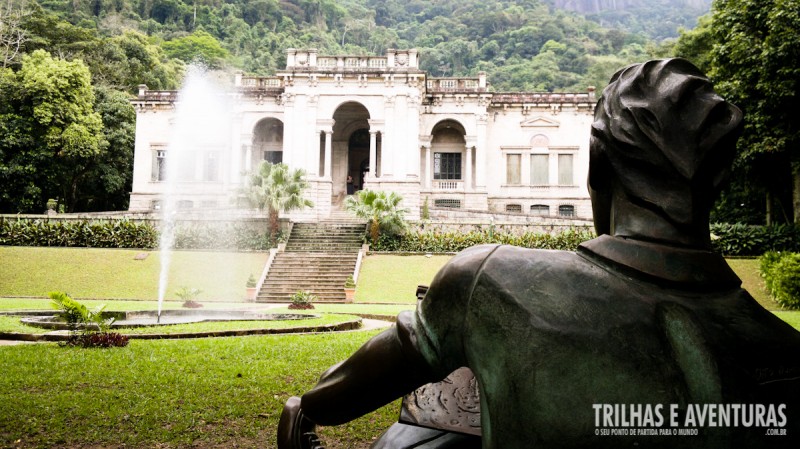
The height and width of the screenshot is (449, 800). In order to click on top of second set of stairs in this screenshot , I will do `click(330, 223)`.